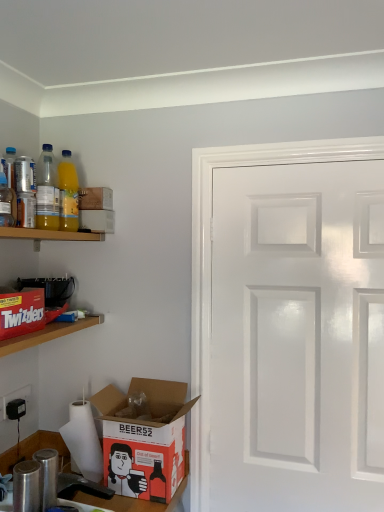
Where is `translucent plastic bottle at upper left, placed as the second bottle when sorted from right to left`? This screenshot has height=512, width=384. translucent plastic bottle at upper left, placed as the second bottle when sorted from right to left is located at coordinates (47, 191).

Describe the element at coordinates (48, 234) in the screenshot. This screenshot has width=384, height=512. I see `wooden shelf at upper left, the second shelf in the bottom-to-top sequence` at that location.

The width and height of the screenshot is (384, 512). Describe the element at coordinates (97, 221) in the screenshot. I see `matte cardboard box at upper left, which appears as the 2th box when ordered from the bottom` at that location.

Where is `brushed metal shaker at lower left, the second appliance viewed from the back`? Image resolution: width=384 pixels, height=512 pixels. brushed metal shaker at lower left, the second appliance viewed from the back is located at coordinates (80, 485).

The width and height of the screenshot is (384, 512). I want to click on matte red cardboard box at left, so click(21, 312).

I want to click on translucent plastic bottle at upper left, placed as the 3th bottle when sorted from front to back, so click(47, 191).

From the picture: From a real-world perspective, who is located higher, black matte coffee maker at left, the 1th appliance viewed from the back, or translucent plastic bottle at upper left, which is counted as the 4th bottle, starting from the back?

translucent plastic bottle at upper left, which is counted as the 4th bottle, starting from the back, is physically above.

Does black matte coffee maker at left, placed as the 1th appliance when sorted from top to bottom, have a smaller size compared to translucent plastic bottle at upper left, placed as the first bottle when sorted from front to back?

No, black matte coffee maker at left, placed as the 1th appliance when sorted from top to bottom, is not smaller than translucent plastic bottle at upper left, placed as the first bottle when sorted from front to back.

Is there a large distance between black matte coffee maker at left, positioned as the second appliance in front-to-back order, and translucent plastic bottle at upper left, the third bottle viewed from the right?

No, black matte coffee maker at left, positioned as the second appliance in front-to-back order, is in close proximity to translucent plastic bottle at upper left, the third bottle viewed from the right.

Which is more distant, [56,298] or [11,215]?

Positioned behind is point [56,298].

Does point (132, 382) come closer to viewer compared to point (107, 188)?

Yes, point (132, 382) is in front of point (107, 188).

Considering the relative sizes of cardboard box at lower left, the 3th box in the top-to-bottom sequence, and matte cardboard box at upper left, which is counted as the 1th box, starting from the top, in the image provided, is cardboard box at lower left, the 3th box in the top-to-bottom sequence, taller than matte cardboard box at upper left, which is counted as the 1th box, starting from the top,?

Indeed, cardboard box at lower left, the 3th box in the top-to-bottom sequence, has a greater height compared to matte cardboard box at upper left, which is counted as the 1th box, starting from the top.

Looking at this image, could you tell me if cardboard box at lower left, the 1th box from the bottom, is facing matte cardboard box at upper left, which is counted as the 1th box, starting from the top?

No.

Looking at this image, considering the positions of objects cardboard box at lower left, the 1th box from the bottom, and matte cardboard box at upper left, which is counted as the 1th box, starting from the top, in the image provided, who is behind, cardboard box at lower left, the 1th box from the bottom, or matte cardboard box at upper left, which is counted as the 1th box, starting from the top,?

matte cardboard box at upper left, which is counted as the 1th box, starting from the top, is behind.

From a real-world perspective, between yellow translucent bottle at upper left, the fourth bottle positioned from the front, and white matte paper towel at lower left, who is vertically lower?

From a 3D spatial view, white matte paper towel at lower left is below.

Based on the photo, considering the relative sizes of yellow translucent bottle at upper left, the fourth bottle positioned from the front, and white matte paper towel at lower left in the image provided, is yellow translucent bottle at upper left, the fourth bottle positioned from the front, bigger than white matte paper towel at lower left?

Incorrect, yellow translucent bottle at upper left, the fourth bottle positioned from the front, is not larger than white matte paper towel at lower left.

Where is `appliance above the brushed metal shaker at lower left, placed as the 1th appliance when sorted from front to back (from the image's perspective)`? The image size is (384, 512). appliance above the brushed metal shaker at lower left, placed as the 1th appliance when sorted from front to back (from the image's perspective) is located at coordinates (50, 289).

Can you confirm if black matte coffee maker at left, positioned as the second appliance in front-to-back order, is smaller than brushed metal shaker at lower left, placed as the 1th appliance when sorted from front to back?

Yes, black matte coffee maker at left, positioned as the second appliance in front-to-back order, is smaller than brushed metal shaker at lower left, placed as the 1th appliance when sorted from front to back.

From a real-world perspective, is black matte coffee maker at left, placed as the 1th appliance when sorted from top to bottom, on top of brushed metal shaker at lower left, placed as the 1th appliance when sorted from bottom to top?

Correct, in the physical world, black matte coffee maker at left, placed as the 1th appliance when sorted from top to bottom, is higher than brushed metal shaker at lower left, placed as the 1th appliance when sorted from bottom to top.

The image size is (384, 512). In order to click on box below the wooden shelf at upper left, the second shelf in the bottom-to-top sequence (from a real-world perspective) in this screenshot , I will do `click(145, 439)`.

Does cardboard box at lower left, the 3th box in the top-to-bottom sequence, turn towards wooden shelf at upper left, which is the first shelf in top-to-bottom order?

No, cardboard box at lower left, the 3th box in the top-to-bottom sequence, does not turn towards wooden shelf at upper left, which is the first shelf in top-to-bottom order.

Which of these two, cardboard box at lower left, the 1th box from the bottom, or wooden shelf at upper left, the second shelf in the bottom-to-top sequence, is smaller?

wooden shelf at upper left, the second shelf in the bottom-to-top sequence, is smaller.

Is brushed metal shaker at lower left, placed as the 1th appliance when sorted from front to back, facing towards white matte paper towel at lower left?

No.

Can you confirm if brushed metal shaker at lower left, the 2th appliance viewed from the top, is bigger than white matte paper towel at lower left?

No, brushed metal shaker at lower left, the 2th appliance viewed from the top, is not bigger than white matte paper towel at lower left.

Considering the relative sizes of brushed metal shaker at lower left, the 2th appliance viewed from the top, and white matte paper towel at lower left in the image provided, is brushed metal shaker at lower left, the 2th appliance viewed from the top, taller than white matte paper towel at lower left?

No, brushed metal shaker at lower left, the 2th appliance viewed from the top, is not taller than white matte paper towel at lower left.

From the picture: Is matte red cardboard box at left taller than translucent plastic bottle at upper left, positioned as the second bottle in left-to-right order?

In fact, matte red cardboard box at left may be shorter than translucent plastic bottle at upper left, positioned as the second bottle in left-to-right order.

From a real-world perspective, starting from the matte red cardboard box at left, which bottle is the 1st one vertically above it? Please provide its 2D coordinates.

[(7, 203)]

Which object is positioned more to the right, matte red cardboard box at left or translucent plastic bottle at upper left, placed as the first bottle when sorted from front to back?

translucent plastic bottle at upper left, placed as the first bottle when sorted from front to back, is more to the right.

Does point (16, 335) come in front of point (11, 204)?

Yes, point (16, 335) is closer to viewer.

Where is `the 1st bottle directly above the black matte coffee maker at left, which is the second appliance in bottom-to-top order (from a real-world perspective)`? This screenshot has height=512, width=384. the 1st bottle directly above the black matte coffee maker at left, which is the second appliance in bottom-to-top order (from a real-world perspective) is located at coordinates pyautogui.click(x=7, y=203).

The height and width of the screenshot is (512, 384). Find the location of `the 1st box counting from the left side of the cardboard box at lower left, the 3th box in the top-to-bottom sequence`. the 1st box counting from the left side of the cardboard box at lower left, the 3th box in the top-to-bottom sequence is located at coordinates (95, 198).

Considering their positions, is wooden shelf at upper left, which is the first shelf in top-to-bottom order, positioned further to translucent plastic bottle at upper left, placed as the second bottle when sorted from right to left, than yellow translucent bottle at upper left, which is the first bottle in right-to-left order?

The object further to translucent plastic bottle at upper left, placed as the second bottle when sorted from right to left, is wooden shelf at upper left, which is the first shelf in top-to-bottom order.

Looking at the image, which one is located further to cardboard box at lower left, the 1th box from the bottom, metallic can at upper left, the fourth bottle from the right, or yellow translucent bottle at upper left, which is the first bottle in right-to-left order?

Based on the image, metallic can at upper left, the fourth bottle from the right, appears to be further to cardboard box at lower left, the 1th box from the bottom.

Estimate the real-world distances between objects in this image. Which object is closer to matte red cardboard box at left, brushed metal shaker at lower left, placed as the 1th appliance when sorted from front to back, or white glossy door at right?

brushed metal shaker at lower left, placed as the 1th appliance when sorted from front to back, is closer to matte red cardboard box at left.

From the image, which object appears to be farther from yellow translucent bottle at upper left, which appears as the 1th bottle when viewed from the back, translucent plastic bottle at upper left, which is counted as the 4th bottle, starting from the back, or metallic can at upper left, the 1th bottle in the left-to-right sequence?

translucent plastic bottle at upper left, which is counted as the 4th bottle, starting from the back, lies further to yellow translucent bottle at upper left, which appears as the 1th bottle when viewed from the back, than the other object.

Estimate the real-world distances between objects in this image. Which object is closer to matte cardboard box at upper left, which ranks as the 3th box in bottom-to-top order, wooden shelf at upper left, the second shelf in the bottom-to-top sequence, or translucent plastic bottle at upper left, which is counted as the 4th bottle, starting from the back?

Among the two, wooden shelf at upper left, the second shelf in the bottom-to-top sequence, is located nearer to matte cardboard box at upper left, which ranks as the 3th box in bottom-to-top order.

Considering their positions, is white matte paper towel at lower left positioned further to matte cardboard box at upper left, the second box from the top, than translucent plastic bottle at upper left, which is counted as the 4th bottle, starting from the back?

white matte paper towel at lower left is positioned further to the anchor matte cardboard box at upper left, the second box from the top.

Looking at the image, which one is located closer to matte red cardboard box at left, yellow translucent bottle at upper left, which is the first bottle in right-to-left order, or white glossy door at right?

Among the two, yellow translucent bottle at upper left, which is the first bottle in right-to-left order, is located nearer to matte red cardboard box at left.

Which object lies further to the anchor point wooden shelf at upper left, the second shelf in the bottom-to-top sequence, translucent plastic bottle at upper left, the third bottle viewed from the right, or matte cardboard box at upper left, the second box from the top?

Among the two, translucent plastic bottle at upper left, the third bottle viewed from the right, is located further to wooden shelf at upper left, the second shelf in the bottom-to-top sequence.

Locate an element on the screen. The height and width of the screenshot is (512, 384). box between matte red cardboard box at left and white matte paper towel at lower left in the up-down direction is located at coordinates (145, 439).

Where is `cardboard box between yellow translucent bottle at upper left, which appears as the 4th bottle when viewed from the left, and cardboard box at lower left, the 3th box in the top-to-bottom sequence, vertically`? cardboard box between yellow translucent bottle at upper left, which appears as the 4th bottle when viewed from the left, and cardboard box at lower left, the 3th box in the top-to-bottom sequence, vertically is located at coordinates (21, 312).

Locate an element on the screen. bottle between translucent plastic bottle at upper left, placed as the 3th bottle when sorted from front to back, and white glossy door at right is located at coordinates (68, 194).

Image resolution: width=384 pixels, height=512 pixels. Identify the location of paper towel between matte red cardboard box at left and white glossy door at right. coord(83,441).